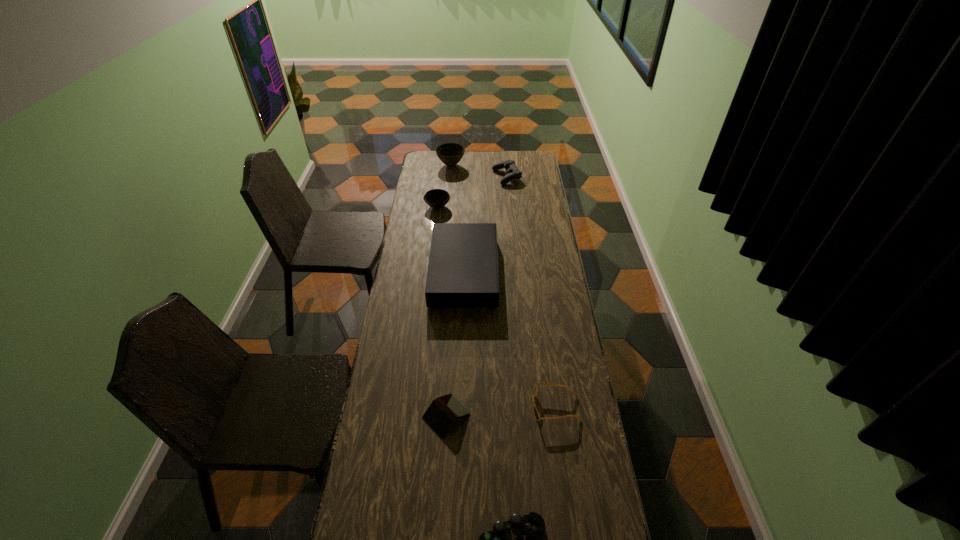
You are a GUI agent. You are given a task and a screenshot of the screen. Output one action in this format:
    pyautogui.click(x=<x>, y=<y>)
    Task: Click on the vacant position located 0.150m on the front of the nearer bowl
    The image size is (960, 540).
    Given the screenshot: What is the action you would take?
    pyautogui.click(x=434, y=232)

Image resolution: width=960 pixels, height=540 pixels. I want to click on free point located 0.370m on the front-facing side of the sunglasses, so click(424, 407).

The image size is (960, 540). In order to click on blank space located 0.230m on the front-facing side of the sunglasses in this screenshot , I will do `click(466, 407)`.

Identify the location of vacant space located on the front-facing side of the sunglasses. This screenshot has height=540, width=960. (450, 407).

In order to click on free location located on the right of the book in this screenshot , I will do `click(527, 415)`.

Where is `bowl positioned at the far edge`? bowl positioned at the far edge is located at coordinates (450, 154).

The width and height of the screenshot is (960, 540). Identify the location of control at the far edge. (513, 173).

Find the location of a particular element. CD player present at the left edge is located at coordinates (462, 271).

Where is `control that is at the right edge`? This screenshot has width=960, height=540. control that is at the right edge is located at coordinates (513, 173).

Where is `sunglasses that is at the right edge`? This screenshot has height=540, width=960. sunglasses that is at the right edge is located at coordinates (536, 414).